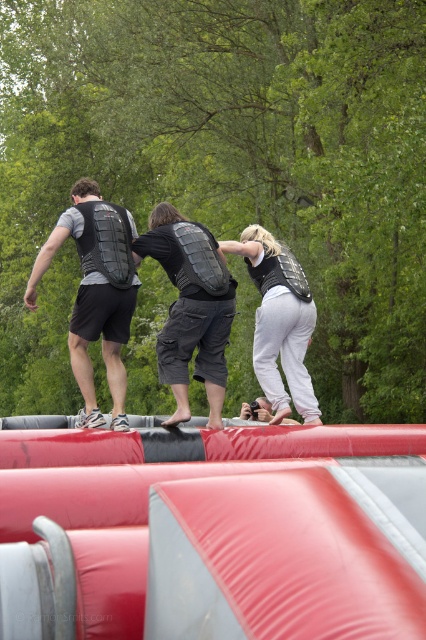
Which is more to the left, matte black vest at upper left or matte black vest at center?

Positioned to the left is matte black vest at upper left.

Which is behind, point (85, 224) or point (296, 376)?

Positioned behind is point (296, 376).

Identify the location of matte black vest at upper left. Image resolution: width=426 pixels, height=640 pixels. (94, 292).

Can you confirm if black matte vest at center is taller than matte black vest at center?

Yes.

Which is more to the right, black matte vest at center or matte black vest at center?

matte black vest at center

Does point (311, 420) come behind point (273, 348)?

Yes, point (311, 420) is farther from viewer.

Find the location of a particular element. This screenshot has height=640, width=426. black matte vest at center is located at coordinates (135, 298).

Is black matte vest at center further to camera compared to matte black vest at upper left?

No, black matte vest at center is closer to the viewer.

What do you see at coordinates (135, 298) in the screenshot? I see `black matte vest at center` at bounding box center [135, 298].

Where is `black matte vest at center`? black matte vest at center is located at coordinates (135, 298).